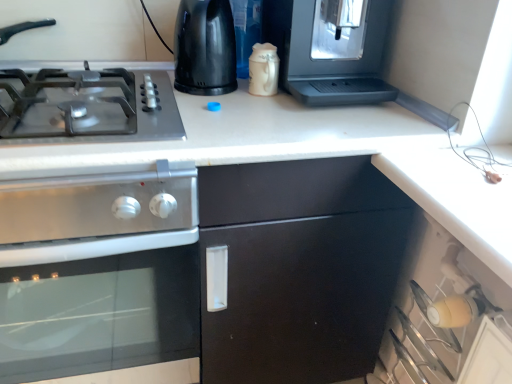
The height and width of the screenshot is (384, 512). In order to click on vacant area that is in front of black plastic kettle at upper center, marked as the first appliance in a left-to-right arrangement in this screenshot , I will do `click(234, 117)`.